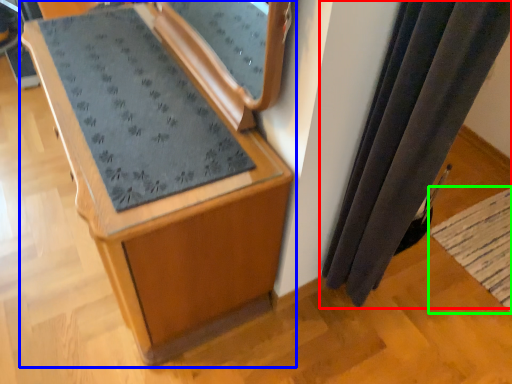
Question: Which object is positioned farthest from curtain (highlighted by a red box)? Select from furniture (highlighted by a blue box) and mat (highlighted by a green box).

Choices:
 (A) furniture
 (B) mat

Answer: (B)